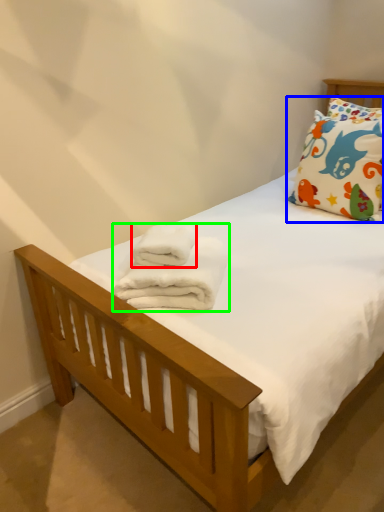
Question: Which object is the closest to the bath towel (highlighted by a red box)? Choose among these: pillow (highlighted by a blue box) or bath towel (highlighted by a green box).

Choices:
 (A) pillow
 (B) bath towel

Answer: (B)